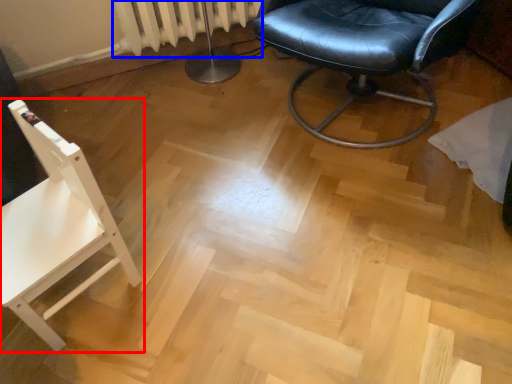
Question: Which object appears farthest to the camera in this image, chair (highlighted by a red box) or radiator (highlighted by a blue box)?

Choices:
 (A) chair
 (B) radiator

Answer: (B)